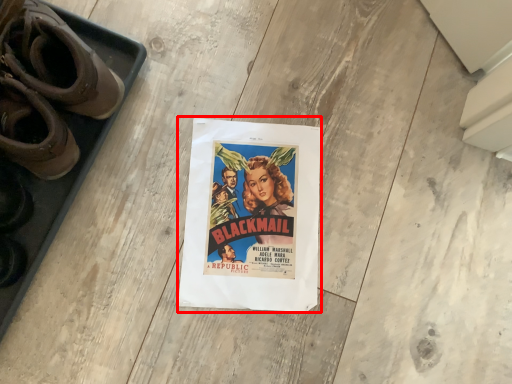
Question: From the image's perspective, considering the relative positions of poster (annotated by the red box) and footwear in the image provided, where is poster (annotated by the red box) located with respect to the staircase?

Choices:
 (A) above
 (B) below

Answer: (B)